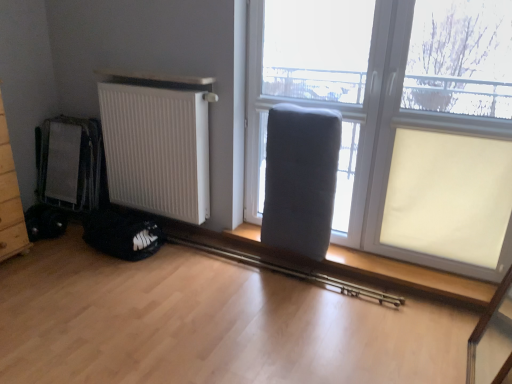
Question: Is gray fabric armchair at center further to camera compared to matte gray cushion at center?

Choices:
 (A) yes
 (B) no

Answer: (A)

Question: Is gray fabric armchair at center placed right next to matte gray cushion at center?

Choices:
 (A) no
 (B) yes

Answer: (A)

Question: Does gray fabric armchair at center contain matte gray cushion at center?

Choices:
 (A) yes
 (B) no

Answer: (B)

Question: Is gray fabric armchair at center positioned in front of matte gray cushion at center?

Choices:
 (A) no
 (B) yes

Answer: (A)

Question: Could you tell me if gray fabric armchair at center is facing matte gray cushion at center?

Choices:
 (A) no
 (B) yes

Answer: (B)

Question: Is gray fabric armchair at center not near matte gray cushion at center?

Choices:
 (A) yes
 (B) no

Answer: (B)

Question: From the image's perspective, would you say matte gray radiator at lower center is positioned over matte gray cushion at center?

Choices:
 (A) yes
 (B) no

Answer: (B)

Question: Is matte gray radiator at lower center wider than matte gray cushion at center?

Choices:
 (A) yes
 (B) no

Answer: (A)

Question: Is matte gray radiator at lower center with matte gray cushion at center?

Choices:
 (A) no
 (B) yes

Answer: (A)

Question: From a real-world perspective, is matte gray radiator at lower center on top of matte gray cushion at center?

Choices:
 (A) no
 (B) yes

Answer: (A)

Question: Does matte gray radiator at lower center have a smaller size compared to matte gray cushion at center?

Choices:
 (A) no
 (B) yes

Answer: (A)

Question: Does matte gray radiator at lower center lie behind matte gray cushion at center?

Choices:
 (A) no
 (B) yes

Answer: (A)

Question: Does white matte radiator at left have a lesser width compared to matte gray cushion at center?

Choices:
 (A) yes
 (B) no

Answer: (B)